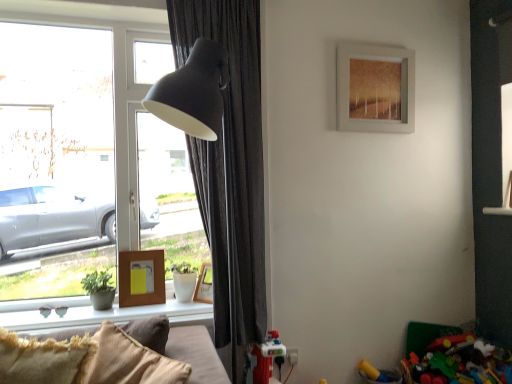
The width and height of the screenshot is (512, 384). Identify the location of free space in front of woodenobject at lower left, which is the first picture frame from left to right. (136, 308).